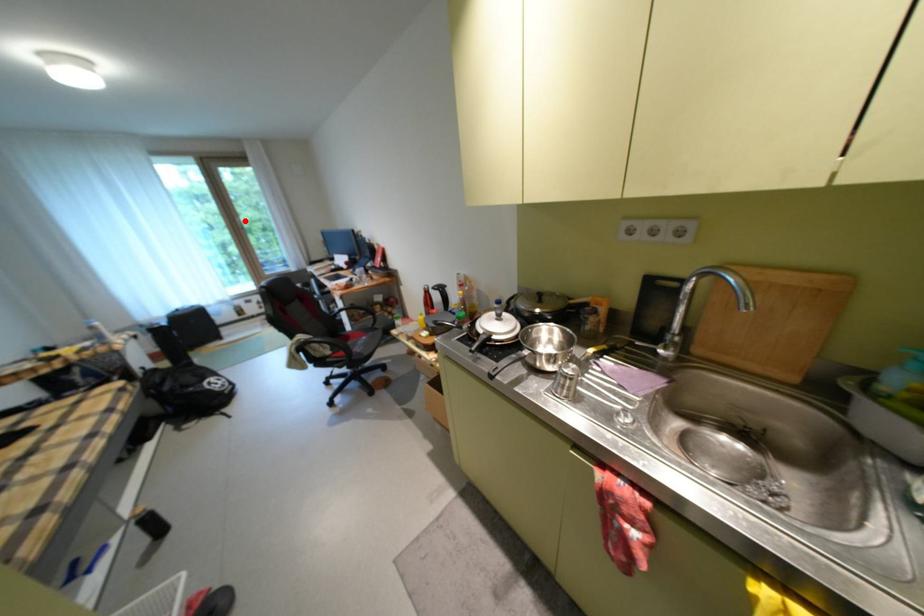
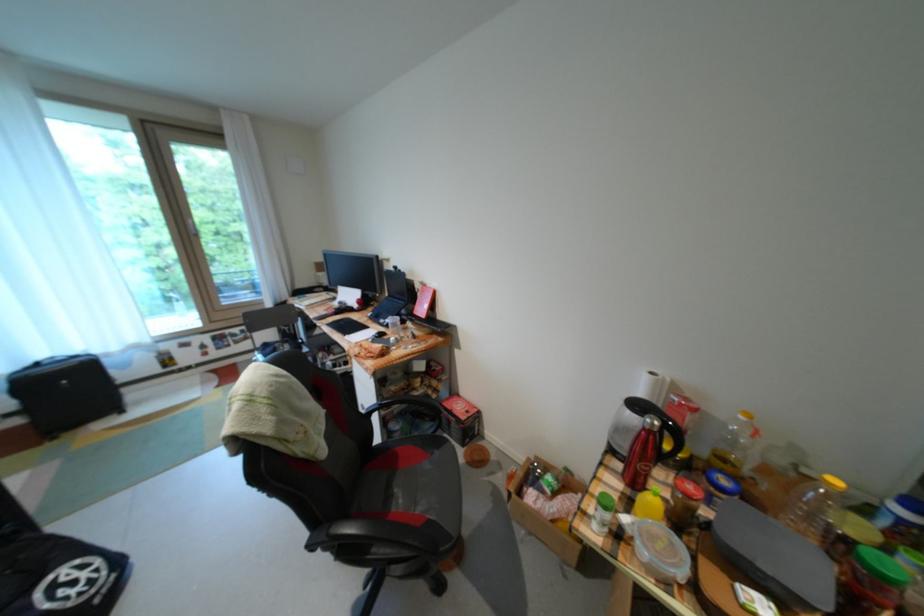
In the second image, find the point that corresponds to the highlighted location in the first image.

(195, 223)